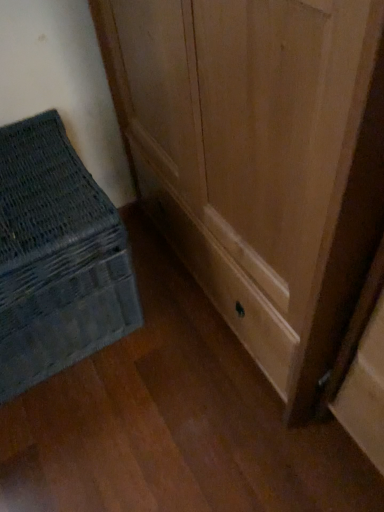
What do you see at coordinates (56, 258) in the screenshot? I see `woven fabric storage box at lower left` at bounding box center [56, 258].

Where is `woven fabric storage box at lower left`? Image resolution: width=384 pixels, height=512 pixels. woven fabric storage box at lower left is located at coordinates (56, 258).

This screenshot has height=512, width=384. In order to click on woven fabric storage box at lower left in this screenshot , I will do `click(56, 258)`.